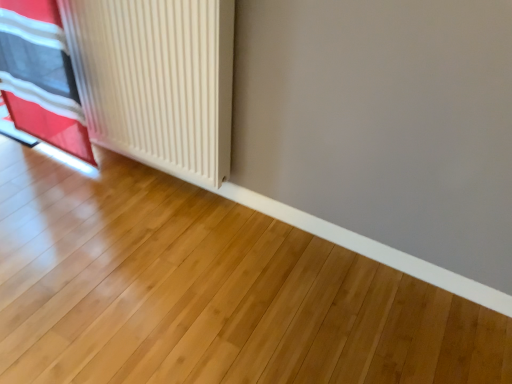
Question: Should I look upward or downward to see white matte radiator at left?

Choices:
 (A) down
 (B) up

Answer: (B)

Question: Can you confirm if white matte radiator at left is taller than red fabric curtain at left?

Choices:
 (A) yes
 (B) no

Answer: (B)

Question: From the image's perspective, would you say white matte radiator at left is positioned over red fabric curtain at left?

Choices:
 (A) yes
 (B) no

Answer: (B)

Question: Is red fabric curtain at left a part of white matte radiator at left?

Choices:
 (A) yes
 (B) no

Answer: (B)

Question: Is white matte radiator at left further to the viewer compared to red fabric curtain at left?

Choices:
 (A) no
 (B) yes

Answer: (A)

Question: From a real-world perspective, is white matte radiator at left positioned over red fabric curtain at left based on gravity?

Choices:
 (A) yes
 (B) no

Answer: (A)

Question: From the image's perspective, is white matte radiator at left beneath red fabric curtain at left?

Choices:
 (A) yes
 (B) no

Answer: (A)

Question: Considering the relative sizes of red fabric curtain at left and white matte radiator at left in the image provided, is red fabric curtain at left bigger than white matte radiator at left?

Choices:
 (A) no
 (B) yes

Answer: (A)

Question: From the image's perspective, does red fabric curtain at left appear lower than white matte radiator at left?

Choices:
 (A) no
 (B) yes

Answer: (A)

Question: Considering the relative sizes of red fabric curtain at left and white matte radiator at left in the image provided, is red fabric curtain at left smaller than white matte radiator at left?

Choices:
 (A) no
 (B) yes

Answer: (B)

Question: From the image's perspective, is red fabric curtain at left located above white matte radiator at left?

Choices:
 (A) no
 (B) yes

Answer: (B)

Question: Is there a large distance between red fabric curtain at left and white matte radiator at left?

Choices:
 (A) no
 (B) yes

Answer: (A)

Question: Does red fabric curtain at left have a greater width compared to white matte radiator at left?

Choices:
 (A) no
 (B) yes

Answer: (A)

Question: In terms of size, does red fabric curtain at left appear bigger or smaller than white matte radiator at left?

Choices:
 (A) small
 (B) big

Answer: (A)